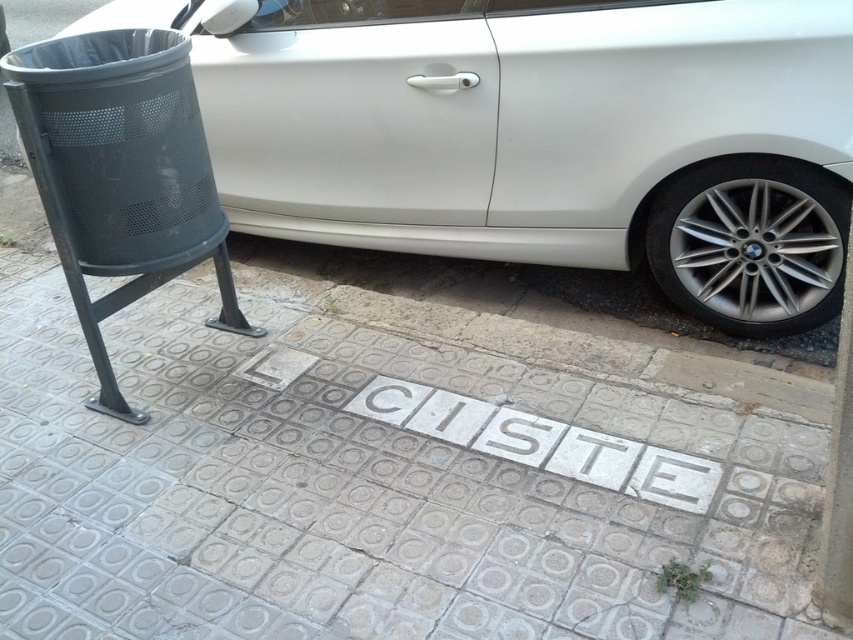
Question: Does white tile pavement at lower center appear under silver metallic wheel at lower right?

Choices:
 (A) yes
 (B) no

Answer: (A)

Question: Among these points, which one is farthest from the camera?

Choices:
 (A) (701, 284)
 (B) (764, 404)

Answer: (A)

Question: Does white tile pavement at lower center lie behind sleek white car at center?

Choices:
 (A) yes
 (B) no

Answer: (B)

Question: Is sleek white car at center behind silver metallic wheel at lower right?

Choices:
 (A) yes
 (B) no

Answer: (B)

Question: Which object appears closest to the camera in this image?

Choices:
 (A) sleek white car at center
 (B) silver metallic wheel at lower right
 (C) white tile pavement at lower center

Answer: (C)

Question: Based on their relative distances, which object is nearer to the white tile pavement at lower center?

Choices:
 (A) sleek white car at center
 (B) silver metallic wheel at lower right

Answer: (A)